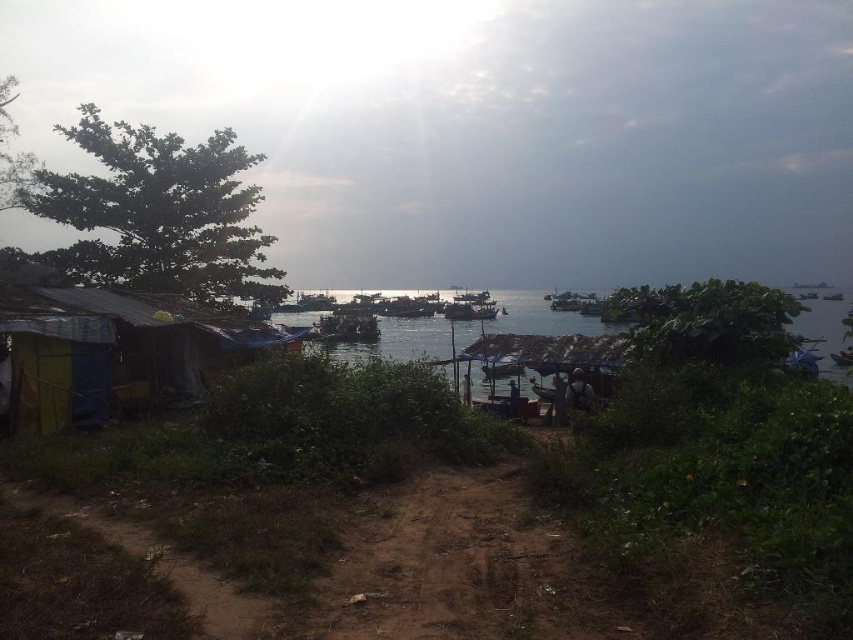
Question: Which of the following is the closest to the observer?

Choices:
 (A) clear water at center
 (B) multicolored tarpaulin hut at lower left

Answer: (A)

Question: Does multicolored tarpaulin hut at lower left appear on the left side of clear water at center?

Choices:
 (A) no
 (B) yes

Answer: (B)

Question: Which point is closer to the camera?

Choices:
 (A) multicolored tarpaulin hut at lower left
 (B) clear water at center

Answer: (B)

Question: Does multicolored tarpaulin hut at lower left have a smaller size compared to clear water at center?

Choices:
 (A) yes
 (B) no

Answer: (A)

Question: Can you confirm if multicolored tarpaulin hut at lower left is positioned below clear water at center?

Choices:
 (A) yes
 (B) no

Answer: (A)